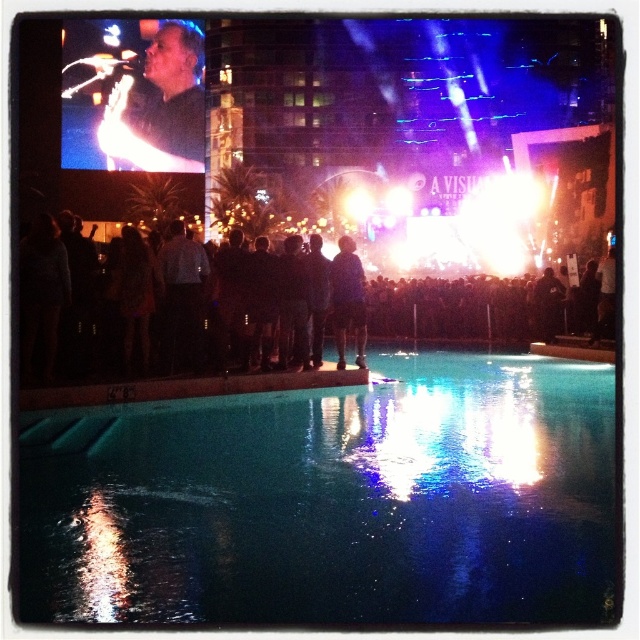
Which is above, clear glass pool at lower center or dark blue fabric at center?

dark blue fabric at center

Does point (468, 570) come farther from viewer compared to point (358, 355)?

No.

Locate an element on the screen. The height and width of the screenshot is (640, 640). clear glass pool at lower center is located at coordinates (330, 500).

Does point (374, 589) lie in front of point (266, 284)?

Yes.

Is clear glass pool at lower center above black fabric crowd at center?

No.

Which is behind, point (390, 529) or point (99, 358)?

Positioned behind is point (99, 358).

The width and height of the screenshot is (640, 640). Identify the location of clear glass pool at lower center. (330, 500).

Between clear glass pool at lower center and matte black shirt at upper left, which one has more height?

With more height is matte black shirt at upper left.

Does clear glass pool at lower center have a lesser height compared to matte black shirt at upper left?

Correct, clear glass pool at lower center is not as tall as matte black shirt at upper left.

Between point (540, 502) and point (124, 120), which one is positioned behind?

Positioned behind is point (124, 120).

I want to click on clear glass pool at lower center, so click(x=330, y=500).